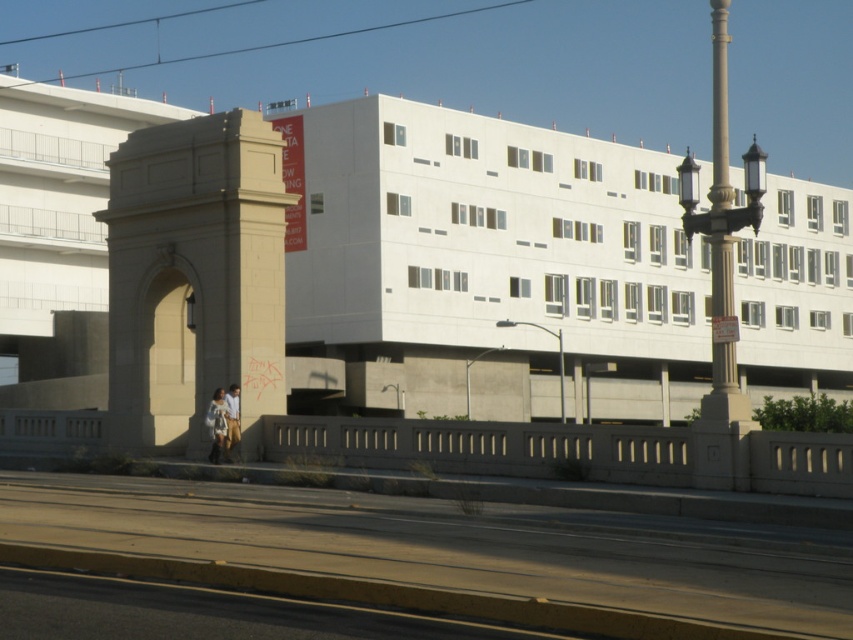
Question: Does white fabric bag at center have a larger size compared to light brown leather jacket at lower center?

Choices:
 (A) yes
 (B) no

Answer: (A)

Question: Which point is closer to the camera?

Choices:
 (A) white fabric bag at center
 (B) light brown leather jacket at lower center
 (C) beige stone arch at left

Answer: (A)

Question: Among these points, which one is farthest from the camera?

Choices:
 (A) (223, 417)
 (B) (112, 262)
 (C) (228, 420)

Answer: (B)

Question: Is white fabric bag at center further to camera compared to light brown leather jacket at lower center?

Choices:
 (A) no
 (B) yes

Answer: (A)

Question: Which object appears farthest from the camera in this image?

Choices:
 (A) beige stone arch at left
 (B) light brown leather jacket at lower center

Answer: (A)

Question: Can you confirm if white fabric bag at center is positioned above light brown leather jacket at lower center?

Choices:
 (A) yes
 (B) no

Answer: (B)